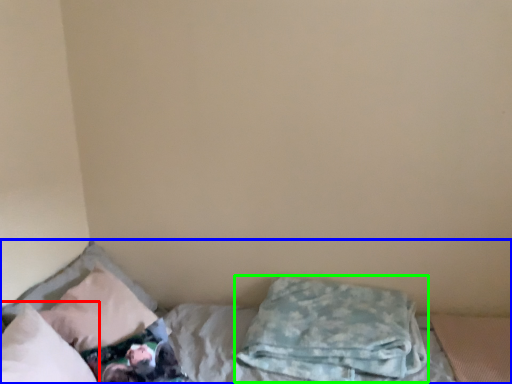
Question: Which is farther away from pillow (highlighted by a red box)? bed (highlighted by a blue box) or pillow (highlighted by a green box)?

Choices:
 (A) bed
 (B) pillow

Answer: (B)